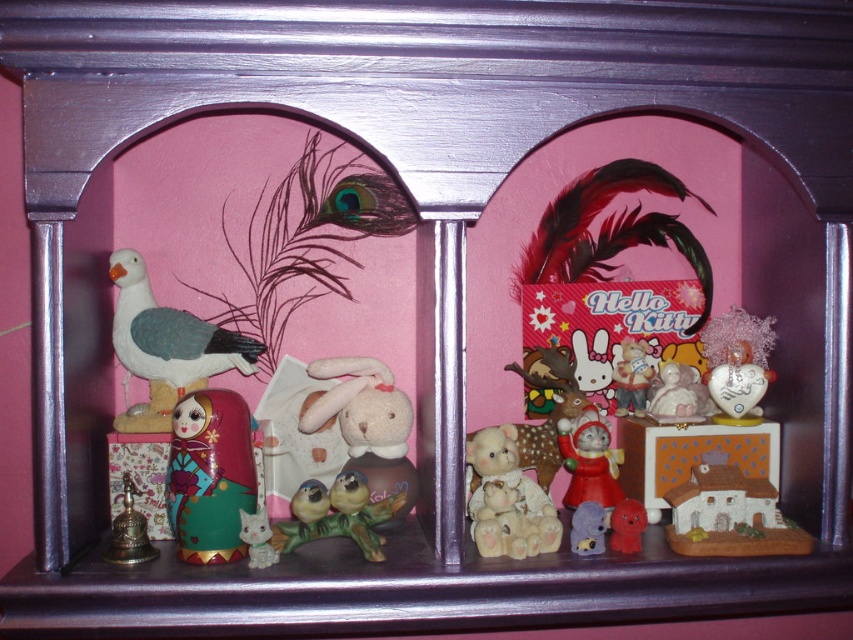
Question: Which point is closer to the camera taking this photo?

Choices:
 (A) (589, 509)
 (B) (335, 508)
 (C) (737, 490)
 (D) (119, 296)

Answer: (A)

Question: Which point is closer to the camera?

Choices:
 (A) (637, 355)
 (B) (372, 458)
 (C) (746, 528)

Answer: (C)

Question: From the image, what is the correct spatial relationship of matte wooden nesting doll at center left in relation to white glossy cat at center?

Choices:
 (A) below
 (B) above

Answer: (B)

Question: Which object appears farthest from the camera in this image?

Choices:
 (A) brass bell at lower left
 (B) matte ceramic figurines at center

Answer: (B)

Question: Is matte ceramic figurines at center below matte plastic cat at center?

Choices:
 (A) no
 (B) yes

Answer: (A)

Question: Is porcelain birds at center thinner than matte plastic cat at center?

Choices:
 (A) yes
 (B) no

Answer: (B)